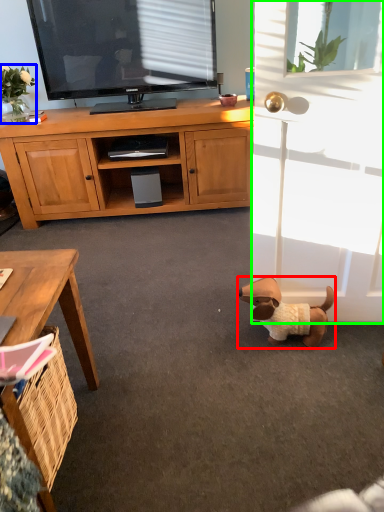
Question: Considering the real-world distances, which object is closest to dog (highlighted by a red box)? flower (highlighted by a blue box) or screen door (highlighted by a green box).

Choices:
 (A) flower
 (B) screen door

Answer: (B)